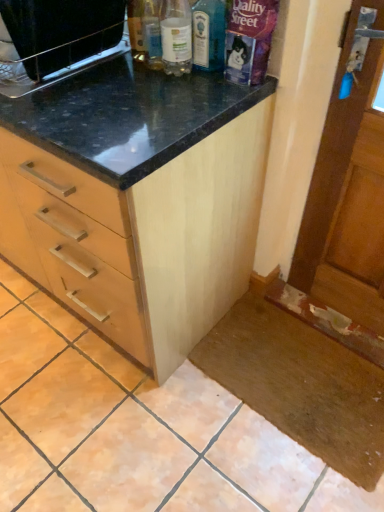
Question: Is translucent glass bottle at center, placed as the second bottle when sorted from left to right, outside of black matte microwave at upper left?

Choices:
 (A) no
 (B) yes

Answer: (B)

Question: Is translucent glass bottle at center, placed as the second bottle when sorted from left to right, next to black matte microwave at upper left?

Choices:
 (A) no
 (B) yes

Answer: (A)

Question: Can black matte microwave at upper left be found inside translucent glass bottle at center, the 1th bottle when ordered from right to left?

Choices:
 (A) yes
 (B) no

Answer: (B)

Question: From a real-world perspective, does translucent glass bottle at center, placed as the second bottle when sorted from left to right, sit lower than black matte microwave at upper left?

Choices:
 (A) yes
 (B) no

Answer: (B)

Question: Is translucent glass bottle at center, placed as the second bottle when sorted from left to right, oriented away from black matte microwave at upper left?

Choices:
 (A) yes
 (B) no

Answer: (B)

Question: Is black matte microwave at upper left inside or outside of translucent glass bottle at center, the 1th bottle when ordered from right to left?

Choices:
 (A) outside
 (B) inside

Answer: (A)

Question: Looking at the image, does black matte microwave at upper left seem bigger or smaller compared to translucent glass bottle at center, the 1th bottle when ordered from right to left?

Choices:
 (A) small
 (B) big

Answer: (B)

Question: In terms of height, does black matte microwave at upper left look taller or shorter compared to translucent glass bottle at center, placed as the second bottle when sorted from left to right?

Choices:
 (A) tall
 (B) short

Answer: (B)

Question: From a real-world perspective, is black matte microwave at upper left physically located above or below translucent glass bottle at center, the 1th bottle when ordered from right to left?

Choices:
 (A) above
 (B) below

Answer: (B)

Question: Does point (11, 175) appear closer or farther from the camera than point (205, 69)?

Choices:
 (A) farther
 (B) closer

Answer: (A)

Question: Is light wood cabinet at center spatially inside translucent glass bottle at center, placed as the second bottle when sorted from left to right, or outside of it?

Choices:
 (A) outside
 (B) inside

Answer: (A)

Question: Considering the positions of light wood cabinet at center and translucent glass bottle at center, placed as the second bottle when sorted from left to right, in the image, is light wood cabinet at center wider or thinner than translucent glass bottle at center, placed as the second bottle when sorted from left to right,?

Choices:
 (A) thin
 (B) wide

Answer: (B)

Question: From the image's perspective, is light wood cabinet at center above or below translucent glass bottle at center, the 1th bottle when ordered from right to left?

Choices:
 (A) above
 (B) below

Answer: (B)

Question: Is clear plastic bottle at upper center, which ranks as the first bottle in left-to-right order, situated inside light wood cabinet at center or outside?

Choices:
 (A) outside
 (B) inside

Answer: (A)

Question: From a real-world perspective, relative to light wood cabinet at center, is clear plastic bottle at upper center, which ranks as the first bottle in left-to-right order, vertically above or below?

Choices:
 (A) above
 (B) below

Answer: (A)